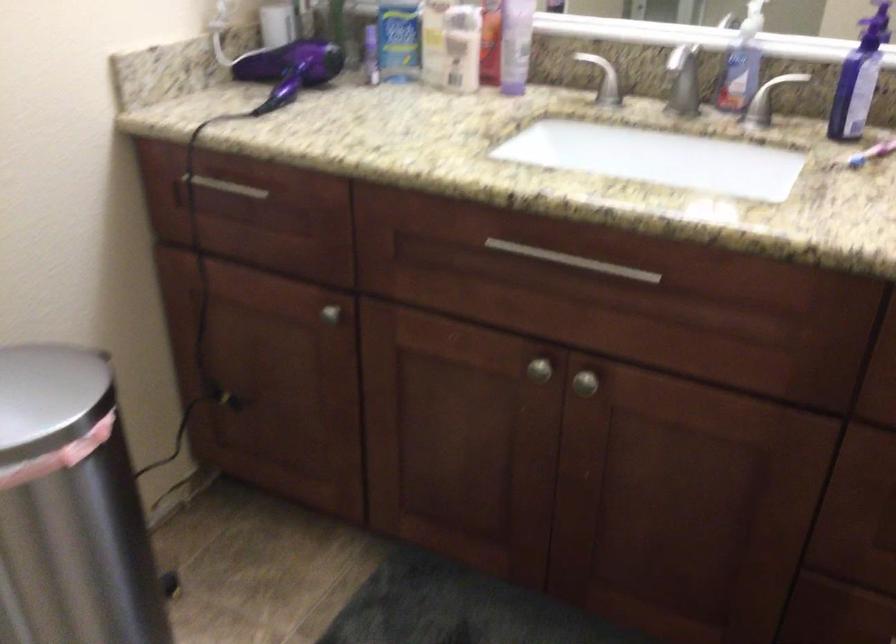
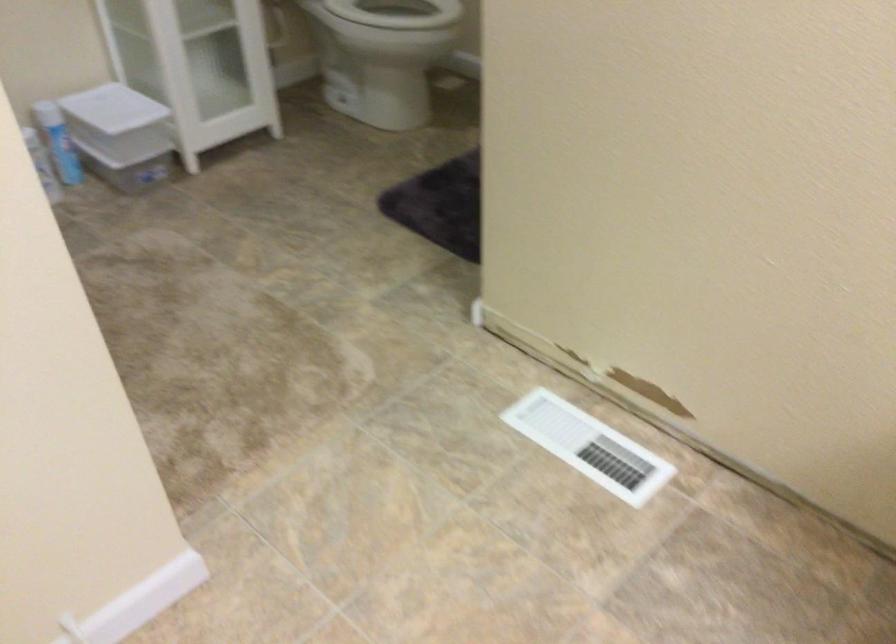
First-person continuous shooting, in which direction is the camera rotating?

The rotation direction of the camera is left-down.